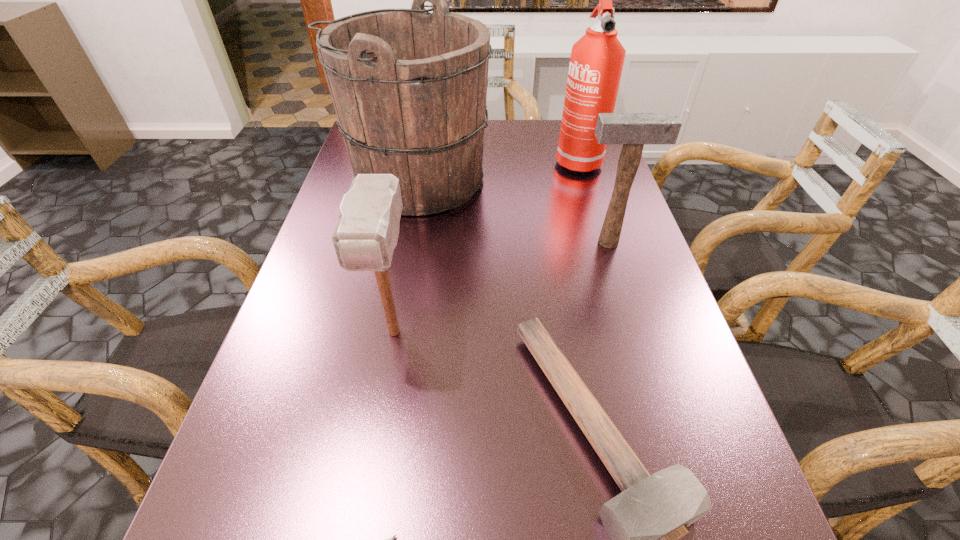
I want to click on object that is the second closest to the leftmost mallet, so click(409, 87).

At what (x,y) coordinates should I click in order to perform the action: click on object that stands as the closest to the farthest mallet. Please return your answer as a coordinate pair (x, y). The width and height of the screenshot is (960, 540). Looking at the image, I should click on (409, 87).

Locate an element on the screen. The width and height of the screenshot is (960, 540). mallet identified as the second closest to the shortest mallet is located at coordinates (633, 130).

You are a GUI agent. You are given a task and a screenshot of the screen. Output one action in this format:
    pyautogui.click(x=<x>, y=<y>)
    Task: Click on the second closest mallet to the fourth nearest object
    Image resolution: width=960 pixels, height=540 pixels.
    Given the screenshot: What is the action you would take?
    pyautogui.click(x=367, y=230)